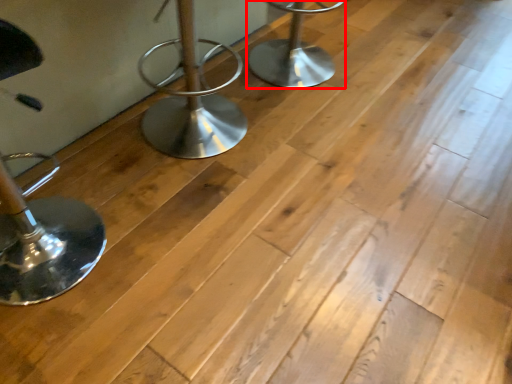
Question: In this image, where is furniture (annotated by the red box) located relative to furniture?

Choices:
 (A) left
 (B) right

Answer: (B)